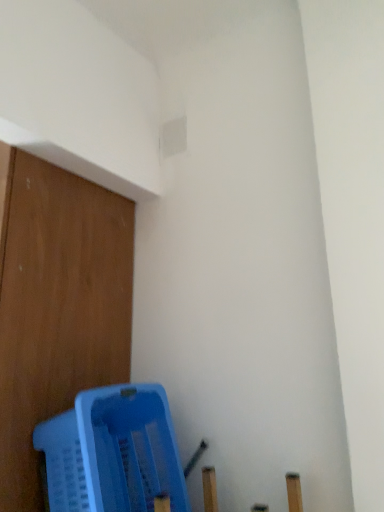
This screenshot has width=384, height=512. What do you see at coordinates (113, 452) in the screenshot? I see `blue plastic swivel chair at lower left` at bounding box center [113, 452].

This screenshot has width=384, height=512. What are the coordinates of `blue plastic swivel chair at lower left` in the screenshot? It's located at (113, 452).

Where is `blue plastic swivel chair at lower left`? blue plastic swivel chair at lower left is located at coordinates (113, 452).